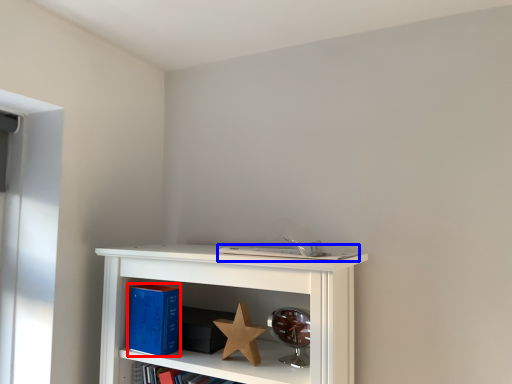
Question: Which point is further to the camera, paperback book (highlighted by a red box) or book (highlighted by a blue box)?

Choices:
 (A) paperback book
 (B) book

Answer: (A)